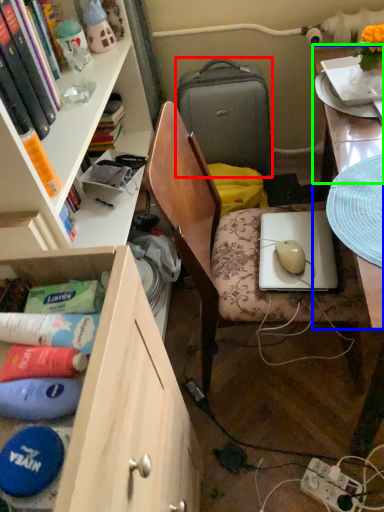
Question: Considering the real-world distances, which object is closest to suitcase (highlighted by a red box)? desk (highlighted by a blue box) or table top (highlighted by a green box).

Choices:
 (A) desk
 (B) table top

Answer: (B)